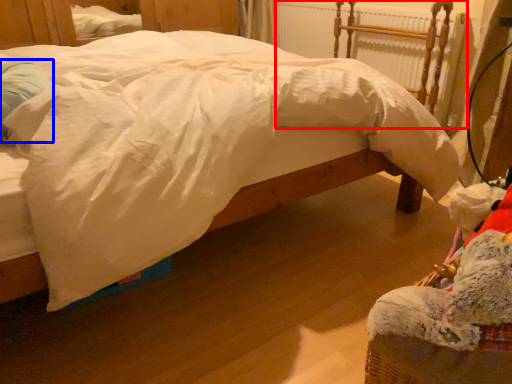
Question: Among these objects, which one is nearest to the camera, radiator (highlighted by a red box) or pillow (highlighted by a blue box)?

Choices:
 (A) radiator
 (B) pillow

Answer: (B)